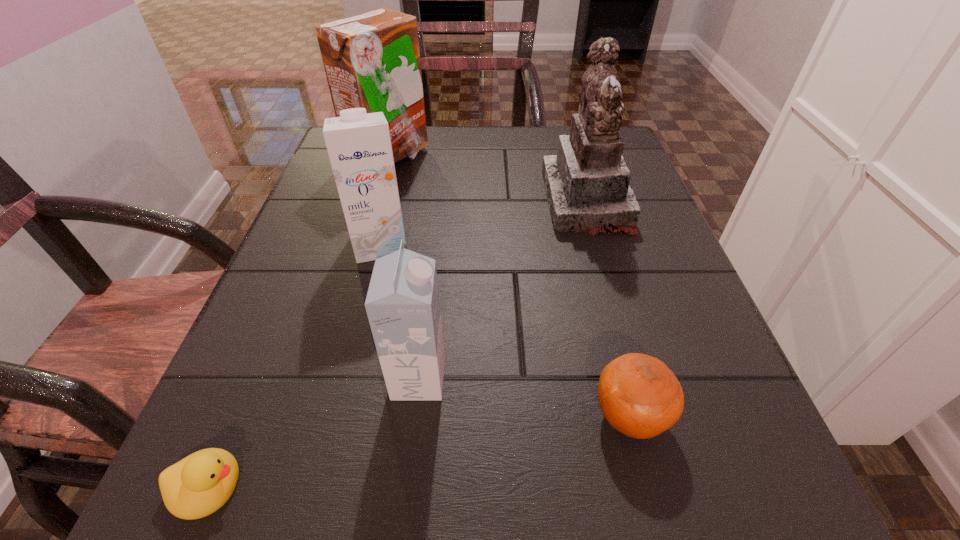
Find the location of a particular element. free space between the shortest object and the farthest carton is located at coordinates (298, 321).

Where is `free space between the orange and the farthest carton`? free space between the orange and the farthest carton is located at coordinates (509, 287).

You are a GUI agent. You are given a task and a screenshot of the screen. Output one action in this format:
    pyautogui.click(x=<x>, y=<y>)
    Task: Click on the free point between the orange and the rightmost carton
    This screenshot has height=540, width=960.
    Given the screenshot: What is the action you would take?
    pyautogui.click(x=524, y=398)

What are the coordinates of `unoccupied area between the figurine and the second farthest carton` in the screenshot? It's located at (483, 222).

Image resolution: width=960 pixels, height=540 pixels. Find the location of `object that ranks as the fifth closest to the second shortest object`. object that ranks as the fifth closest to the second shortest object is located at coordinates (372, 60).

Where is `object that is the closest to the second farthest carton`? object that is the closest to the second farthest carton is located at coordinates (372, 60).

Find the location of a particular element. This screenshot has height=540, width=960. the third closest carton to the nearest object is located at coordinates (372, 60).

Locate an element on the screen. carton that is the second closest one to the second nearest carton is located at coordinates (402, 303).

Locate an element on the screen. The width and height of the screenshot is (960, 540). vacant space that satisfies the following two spatial constraints: 1. on the front label of the fifth tallest object; 2. on the left side of the fourth object from left to right is located at coordinates (414, 417).

Locate an element on the screen. The image size is (960, 540). free point that satisfies the following two spatial constraints: 1. on the straw side of the farthest carton; 2. on the right side of the second nearest carton is located at coordinates point(363,244).